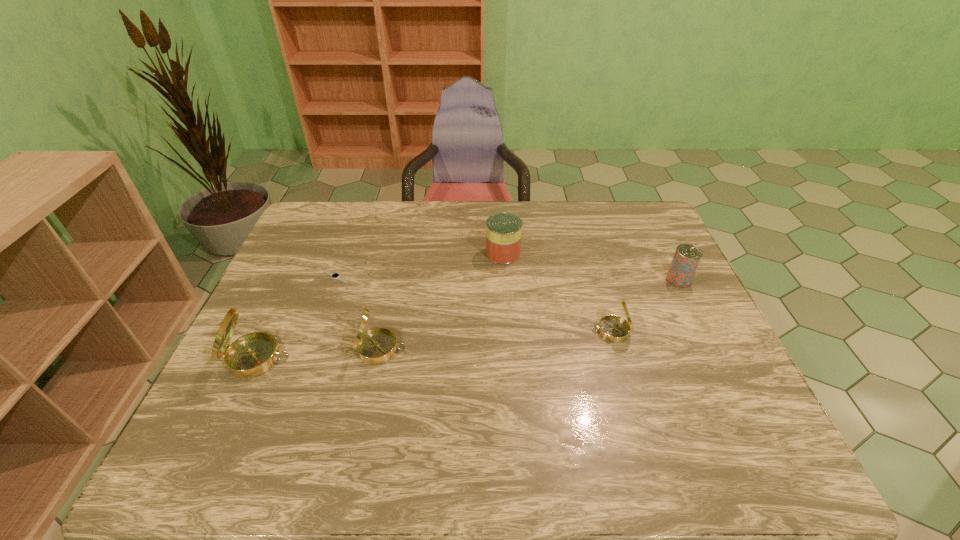
Find the location of a particular element. This screenshot has width=960, height=540. the rightmost object is located at coordinates (686, 258).

At what (x,y) coordinates should I click in order to perform the action: click on blank space located 0.110m with the dial facing the tallest compass. Please return your answer as a coordinate pair (x, y). The width and height of the screenshot is (960, 540). Looking at the image, I should click on (333, 358).

You are a GUI agent. You are given a task and a screenshot of the screen. Output one action in this format:
    pyautogui.click(x=<x>, y=<y>)
    Task: Click on the free space located 0.340m with the dial facing the second compass from left to right
    
    Given the screenshot: What is the action you would take?
    pyautogui.click(x=541, y=349)

In order to click on free space located with the dial facing the shortest compass in this screenshot , I will do `click(558, 330)`.

Where is `free region located 0.230m with the dial facing the shortest compass`? This screenshot has height=540, width=960. free region located 0.230m with the dial facing the shortest compass is located at coordinates (503, 330).

Where is `free space located with the dial facing the shortest compass`? free space located with the dial facing the shortest compass is located at coordinates (542, 330).

Identify the location of free spot located 0.330m on the front of the third object from right to left. This screenshot has height=540, width=960. 509,350.

Where is `vacant space situated 0.400m on the front of the watch`? vacant space situated 0.400m on the front of the watch is located at coordinates (289, 406).

You are a GUI agent. You are given a task and a screenshot of the screen. Output one action in this format:
    pyautogui.click(x=<x>, y=<y>)
    Task: Click on the vacant space located on the back of the rightmost object
    
    Given the screenshot: What is the action you would take?
    pyautogui.click(x=650, y=222)

Identify the location of compass at the left edge. Image resolution: width=960 pixels, height=540 pixels. (253, 354).